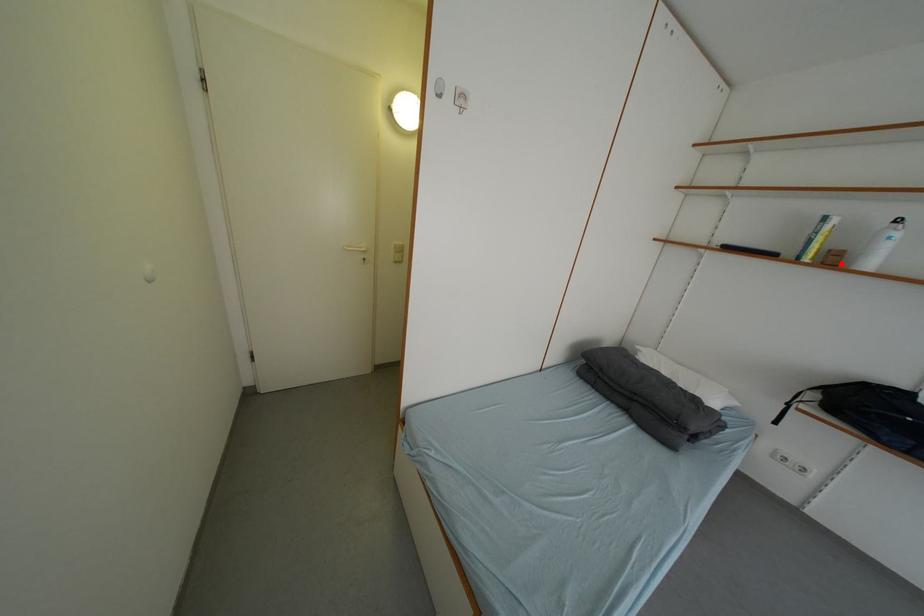
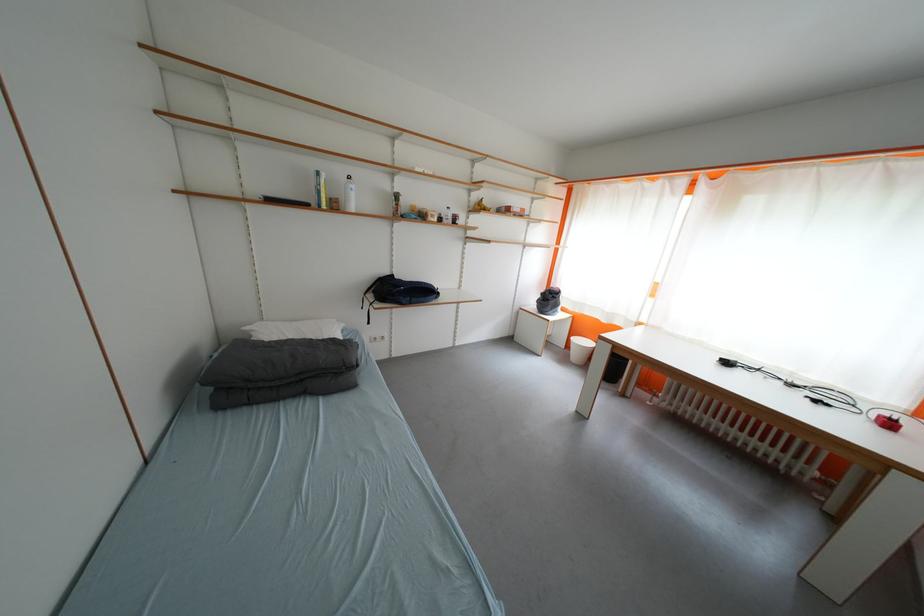
Locate, in the second image, the point that corresponds to the highlighted location in the first image.

(344, 209)